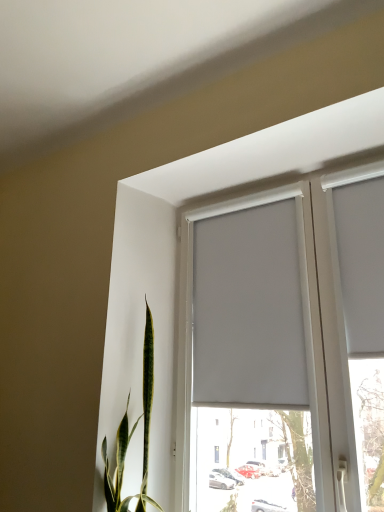
Question: Can you confirm if white matte curtain at upper center, the 2th curtain from the right, is smaller than white matte curtain at upper right, the 1th curtain when ordered from right to left?

Choices:
 (A) no
 (B) yes

Answer: (A)

Question: Is white matte curtain at upper center, the first curtain positioned from the left, not near white matte curtain at upper right, the 1th curtain when ordered from right to left?

Choices:
 (A) yes
 (B) no

Answer: (B)

Question: From a real-world perspective, is white matte curtain at upper center, the first curtain positioned from the left, on top of white matte curtain at upper right, the 1th curtain when ordered from right to left?

Choices:
 (A) yes
 (B) no

Answer: (B)

Question: Is white matte curtain at upper center, the 2th curtain from the right, outside of white matte curtain at upper right, the 1th curtain when ordered from right to left?

Choices:
 (A) yes
 (B) no

Answer: (A)

Question: Does white matte curtain at upper center, the 2th curtain from the right, turn towards white matte curtain at upper right, which is counted as the second curtain, starting from the left?

Choices:
 (A) no
 (B) yes

Answer: (A)

Question: From their relative heights in the image, would you say white matte curtain at upper right, which is counted as the second curtain, starting from the left, is taller or shorter than white matte curtain at upper center, the first curtain positioned from the left?

Choices:
 (A) short
 (B) tall

Answer: (A)

Question: Considering the positions of white matte curtain at upper right, which is counted as the second curtain, starting from the left, and white matte curtain at upper center, the first curtain positioned from the left, in the image, is white matte curtain at upper right, which is counted as the second curtain, starting from the left, bigger or smaller than white matte curtain at upper center, the first curtain positioned from the left,?

Choices:
 (A) big
 (B) small

Answer: (B)

Question: From the image's perspective, is white matte curtain at upper right, which is counted as the second curtain, starting from the left, located above or below white matte curtain at upper center, the 2th curtain from the right?

Choices:
 (A) below
 (B) above

Answer: (B)

Question: In terms of width, does white matte curtain at upper right, which is counted as the second curtain, starting from the left, look wider or thinner when compared to white matte curtain at upper center, the first curtain positioned from the left?

Choices:
 (A) wide
 (B) thin

Answer: (B)

Question: From a real-world perspective, is white matte curtain at upper center, the first curtain positioned from the left, physically located above or below white matte curtain at upper right, the 1th curtain when ordered from right to left?

Choices:
 (A) above
 (B) below

Answer: (B)

Question: From the image's perspective, is white matte curtain at upper center, the first curtain positioned from the left, positioned above or below white matte curtain at upper right, the 1th curtain when ordered from right to left?

Choices:
 (A) above
 (B) below

Answer: (B)

Question: From their relative heights in the image, would you say white matte curtain at upper center, the first curtain positioned from the left, is taller or shorter than white matte curtain at upper right, which is counted as the second curtain, starting from the left?

Choices:
 (A) tall
 (B) short

Answer: (A)

Question: Considering the relative positions of white matte curtain at upper center, the first curtain positioned from the left, and white matte curtain at upper right, the 1th curtain when ordered from right to left, in the image provided, is white matte curtain at upper center, the first curtain positioned from the left, to the left or to the right of white matte curtain at upper right, the 1th curtain when ordered from right to left,?

Choices:
 (A) left
 (B) right

Answer: (A)

Question: Based on their positions, is white matte curtain at upper right, the 1th curtain when ordered from right to left, located to the left or right of white matte window at center?

Choices:
 (A) left
 (B) right

Answer: (B)

Question: Relative to white matte window at center, is white matte curtain at upper right, the 1th curtain when ordered from right to left, in front or behind?

Choices:
 (A) front
 (B) behind

Answer: (B)